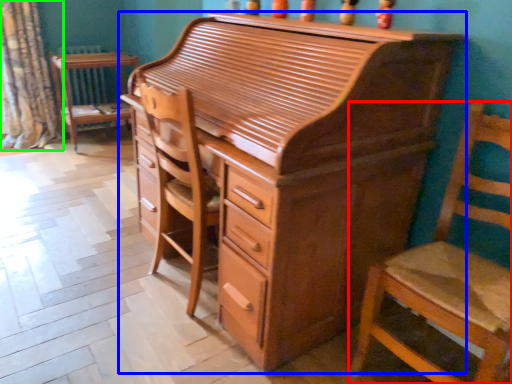
Question: Which object is positioned farthest from chair (highlighted by a red box)? Select from chest of drawers (highlighted by a blue box) and curtain (highlighted by a green box).

Choices:
 (A) chest of drawers
 (B) curtain

Answer: (B)